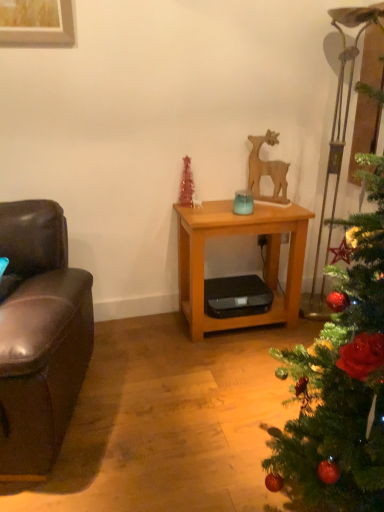
This screenshot has width=384, height=512. What do you see at coordinates (239, 234) in the screenshot? I see `wooden table at center` at bounding box center [239, 234].

I want to click on wooden table at center, so click(239, 234).

This screenshot has height=512, width=384. Find the location of `wooden deer at center`. wooden deer at center is located at coordinates point(267,170).

From the image's perspective, does green matte christmas tree at right appear higher than brown leather couch at left?

Yes, from the image's perspective, green matte christmas tree at right is above brown leather couch at left.

Is point (302, 359) positioned before point (68, 298)?

Yes, point (302, 359) is in front of point (68, 298).

Is green matte christmas tree at right shorter than brown leather couch at left?

No, green matte christmas tree at right is not shorter than brown leather couch at left.

Which of these two, green matte christmas tree at right or brown leather couch at left, is wider?

brown leather couch at left.

Which is farther from the camera, (28, 441) or (251, 316)?

Positioned behind is point (251, 316).

Does brown leather couch at left turn towards wooden table at center?

No, brown leather couch at left is not facing towards wooden table at center.

In the scene shown: Is brown leather couch at left to the left or to the right of wooden table at center in the image?

In the image, brown leather couch at left appears on the left side of wooden table at center.

Is brown leather couch at left in front of or behind wooden table at center in the image?

brown leather couch at left is in front of wooden table at center.

From the image's perspective, is wooden table at center located above or below green matte christmas tree at right?

Clearly, from the image's perspective, wooden table at center is above green matte christmas tree at right.

Considering the sizes of wooden table at center and green matte christmas tree at right in the image, is wooden table at center bigger or smaller than green matte christmas tree at right?

Clearly, wooden table at center is smaller in size than green matte christmas tree at right.

Is wooden table at center placed right next to green matte christmas tree at right?

No, wooden table at center is not with green matte christmas tree at right.

Which object is further away from the camera, wooden table at center or green matte christmas tree at right?

wooden table at center is behind.

Is brown leather couch at left next to wooden deer at center and touching it?

No, brown leather couch at left is not touching wooden deer at center.

Would you say brown leather couch at left is to the left or to the right of wooden deer at center in the picture?

In the image, brown leather couch at left appears on the left side of wooden deer at center.

From the image's perspective, is brown leather couch at left positioned above or below wooden deer at center?

brown leather couch at left is below wooden deer at center.

Identify the location of studio couch below the wooden deer at center (from the image's perspective). (40, 338).

Does green matte christmas tree at right appear on the right side of wooden deer at center?

Indeed, green matte christmas tree at right is positioned on the right side of wooden deer at center.

Between green matte christmas tree at right and wooden deer at center, which one has larger width?

Wider between the two is green matte christmas tree at right.

Which of these two, green matte christmas tree at right or wooden deer at center, stands taller?

With more height is green matte christmas tree at right.

From the image's perspective, does green matte christmas tree at right appear lower than wooden deer at center?

Indeed, from the image's perspective, green matte christmas tree at right is shown beneath wooden deer at center.

Which object is more forward, wooden table at center or wooden deer at center?

wooden table at center is closer to the camera.

From a real-world perspective, relative to wooden deer at center, is wooden table at center vertically above or below?

In terms of real-world spatial position, wooden table at center is below wooden deer at center.

Is wooden table at center touching wooden deer at center?

No, wooden table at center is not in contact with wooden deer at center.

How many degrees apart are the facing directions of wooden table at center and wooden deer at center?

The angular difference between wooden table at center and wooden deer at center is 50.4 degrees.

Is the position of wooden deer at center less distant than that of wooden table at center?

No, it is not.

Is wooden deer at center wider than wooden table at center?

No, wooden deer at center is not wider than wooden table at center.

From a real-world perspective, relative to wooden table at center, is wooden deer at center vertically above or below?

wooden deer at center is situated higher than wooden table at center in the real world.

From the picture: Are wooden deer at center and wooden table at center making contact?

No, wooden deer at center is not touching wooden table at center.

Identify the location of christmas tree located above the brown leather couch at left (from the image's perspective). tap(341, 380).

Locate an element on the screen. The height and width of the screenshot is (512, 384). desk beneath the brown leather couch at left (from a real-world perspective) is located at coordinates (239, 234).

From the image, which object appears to be farther from green matte christmas tree at right, wooden table at center or brown leather couch at left?

wooden table at center is further to green matte christmas tree at right.

Based on their spatial positions, is brown leather couch at left or wooden deer at center closer to wooden table at center?

A: wooden deer at center is closer to wooden table at center.

Based on their spatial positions, is brown leather couch at left or wooden table at center further from green matte christmas tree at right?

wooden table at center is further to green matte christmas tree at right.

Looking at the image, which one is located closer to wooden deer at center, brown leather couch at left or green matte christmas tree at right?

The object closer to wooden deer at center is green matte christmas tree at right.

Based on their spatial positions, is wooden deer at center or brown leather couch at left closer to green matte christmas tree at right?

The object closer to green matte christmas tree at right is brown leather couch at left.

Looking at the image, which one is located closer to brown leather couch at left, wooden table at center or green matte christmas tree at right?

wooden table at center is closer to brown leather couch at left.

From the picture: Which object lies further to the anchor point wooden deer at center, brown leather couch at left or wooden table at center?

brown leather couch at left is further to wooden deer at center.

From the image, which object appears to be nearer to wooden table at center, wooden deer at center or brown leather couch at left?

wooden deer at center is closer to wooden table at center.

The height and width of the screenshot is (512, 384). Find the location of `desk positioned between green matte christmas tree at right and wooden deer at center from near to far`. desk positioned between green matte christmas tree at right and wooden deer at center from near to far is located at coordinates (239, 234).

You are a GUI agent. You are given a task and a screenshot of the screen. Output one action in this format:
    pyautogui.click(x=<x>, y=<y>)
    Task: Click on the studio couch between green matte christmas tree at right and wooden table at center along the z-axis
    
    Given the screenshot: What is the action you would take?
    pyautogui.click(x=40, y=338)

This screenshot has width=384, height=512. I want to click on desk between brown leather couch at left and wooden deer at center from left to right, so pyautogui.click(x=239, y=234).

This screenshot has height=512, width=384. I want to click on studio couch between green matte christmas tree at right and wooden deer at center from front to back, so click(x=40, y=338).